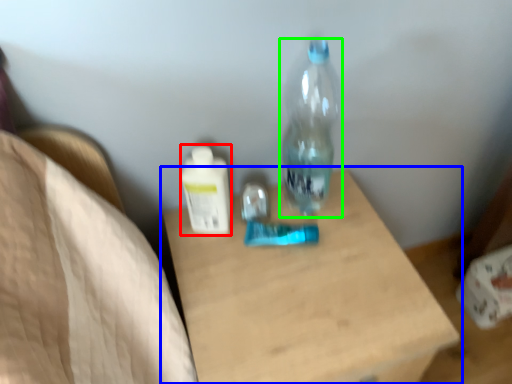
Question: Estimate the real-world distances between objects in this image. Which object is farther from bottle (highlighted by a red box), table (highlighted by a blue box) or bottle (highlighted by a green box)?

Choices:
 (A) table
 (B) bottle

Answer: (A)